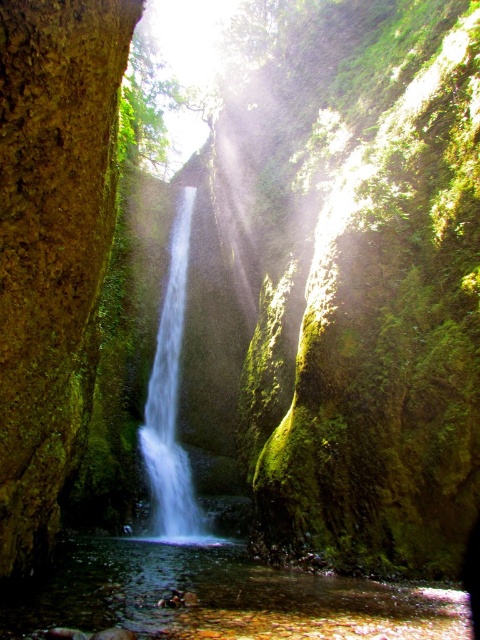
Question: Among these points, which one is farthest from the camera?

Choices:
 (A) (179, 278)
 (B) (362, 634)

Answer: (A)

Question: Does clear water at center appear under white smooth waterfall at center?

Choices:
 (A) no
 (B) yes

Answer: (B)

Question: Which point appears farthest from the camera in this image?

Choices:
 (A) (93, 579)
 (B) (151, 458)

Answer: (B)

Question: Is clear water at center wider than white smooth waterfall at center?

Choices:
 (A) no
 (B) yes

Answer: (B)

Question: Among these objects, which one is farthest from the camera?

Choices:
 (A) white smooth waterfall at center
 (B) clear water at center

Answer: (A)

Question: Where is clear water at center located in relation to white smooth waterfall at center in the image?

Choices:
 (A) left
 (B) right

Answer: (B)